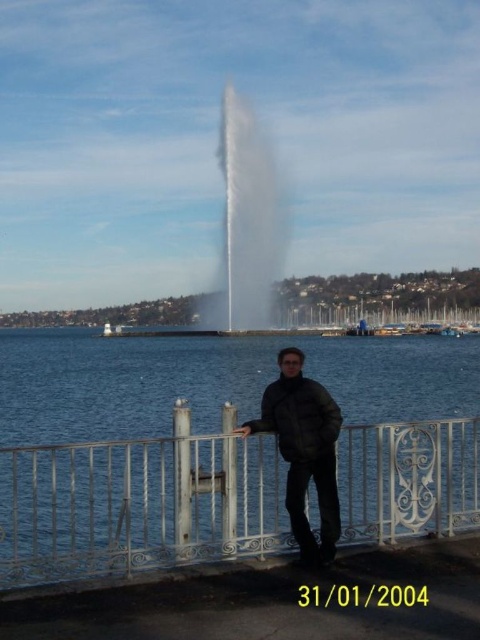
Can you confirm if white frothy water at center is shorter than black matte jacket at center?

Incorrect, white frothy water at center's height does not fall short of black matte jacket at center's.

Which is in front, point (245, 300) or point (300, 508)?

Point (300, 508) is more forward.

Where is `white frothy water at center`? white frothy water at center is located at coordinates (247, 221).

This screenshot has width=480, height=640. I want to click on white frothy water at center, so click(247, 221).

What do you see at coordinates (139, 504) in the screenshot? I see `white wrought iron fence at lower center` at bounding box center [139, 504].

Can you confirm if white wrought iron fence at lower center is positioned above black matte jacket at center?

No.

Find the location of a particular element. white wrought iron fence at lower center is located at coordinates (139, 504).

You are a GUI agent. You are given a task and a screenshot of the screen. Output one action in this format:
    pyautogui.click(x=<x>, y=<y>)
    Task: Click on the white wrought iron fence at lower center
    The width and height of the screenshot is (480, 640).
    Given the screenshot: What is the action you would take?
    pyautogui.click(x=139, y=504)

Where is `white wrought iron fence at lower center`? white wrought iron fence at lower center is located at coordinates (139, 504).

Which is more to the right, white wrought iron fence at lower center or white frothy water at center?

white wrought iron fence at lower center

Between point (406, 426) and point (228, 256), which one is positioned behind?

Point (228, 256)

Identify the location of white wrought iron fence at lower center. (139, 504).